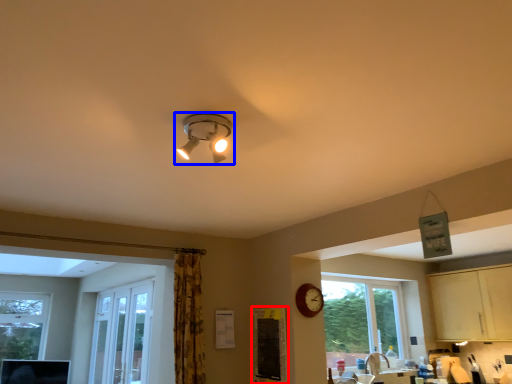
Question: Which object appears closest to the camera in this image, bulletin board (highlighted by a red box) or lamp (highlighted by a blue box)?

Choices:
 (A) bulletin board
 (B) lamp

Answer: (B)